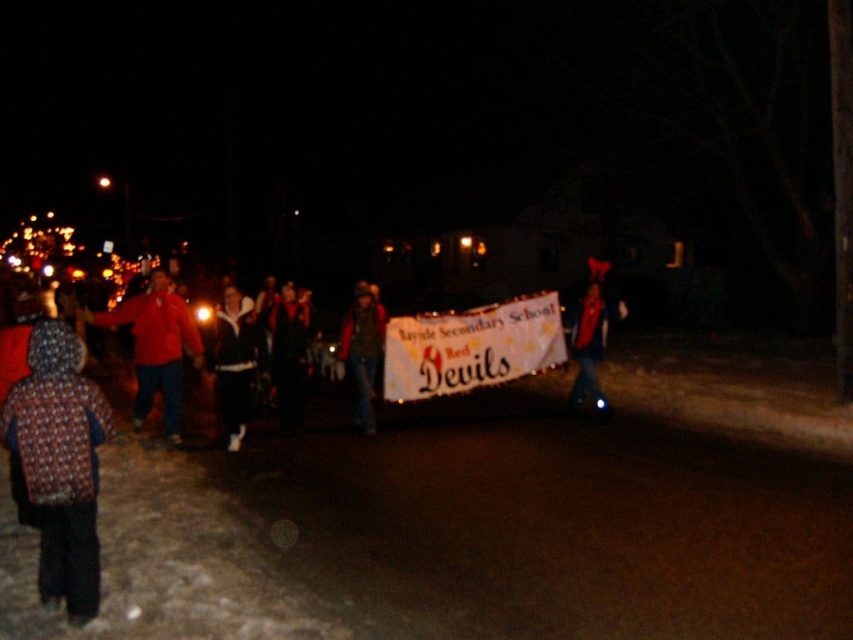
Does velvet black coat at center appear on the left side of matte black jacket at center?

Indeed, velvet black coat at center is positioned on the left side of matte black jacket at center.

In the scene shown: Is velvet black coat at center below matte black jacket at center?

Indeed, velvet black coat at center is positioned under matte black jacket at center.

Which is behind, point (293, 406) or point (361, 285)?

Point (361, 285)

The width and height of the screenshot is (853, 640). Identify the location of velvet black coat at center. (288, 353).

Is red matte jacket at left behind matte black jacket at center?

No, red matte jacket at left is in front of matte black jacket at center.

Which is behind, point (167, 332) or point (355, 403)?

Positioned behind is point (355, 403).

This screenshot has height=640, width=853. I want to click on red matte jacket at left, so click(x=155, y=346).

Which of these two, black fleece jacket at center or red scarf at center, stands taller?

With more height is red scarf at center.

Between point (219, 355) and point (604, 310), which one is positioned behind?

The point (604, 310) is behind.

Find the location of a particular element. The height and width of the screenshot is (640, 853). black fleece jacket at center is located at coordinates (234, 362).